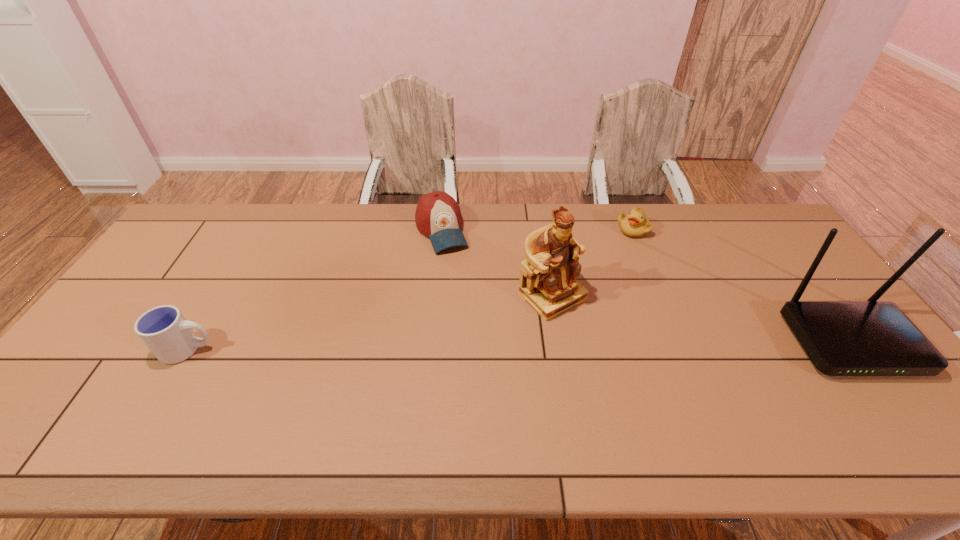
You are a GUI agent. You are given a task and a screenshot of the screen. Output one action in this format:
    pyautogui.click(x=<x>, y=<y>)
    Task: Click on the vacant space on the desktop that is between the cup and the rightmost object and is positioned on the front-facing side of the fourth object from right to left
    The image size is (960, 540).
    Given the screenshot: What is the action you would take?
    pyautogui.click(x=496, y=346)

This screenshot has height=540, width=960. I want to click on vacant space on the desktop that is between the leftmost object and the rightmost object and is positioned on the front-facing side of the figurine, so click(602, 345).

You are a GUI agent. You are given a task and a screenshot of the screen. Output one action in this format:
    pyautogui.click(x=<x>, y=<y>)
    Task: Click on the free spot on the desktop that is between the cup and the rightmost object and is positioned on the front-facing side of the duckling
    This screenshot has width=960, height=540.
    Given the screenshot: What is the action you would take?
    pyautogui.click(x=582, y=345)